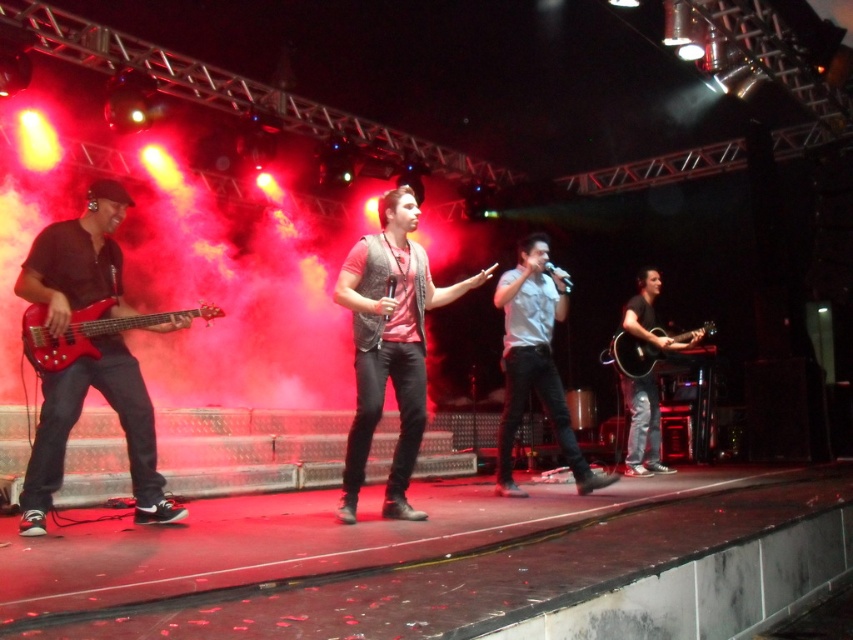
Measure the distance between matte black bass guitar at left and camera.

3.56 meters

Does matte black bass guitar at left have a greater width compared to gray matte shirt at center?

No.

Find the location of a particular element. The height and width of the screenshot is (640, 853). matte black bass guitar at left is located at coordinates (74, 420).

Who is lower down, denim vest at center or acoustic guitar at right?

acoustic guitar at right

Is denim vest at center closer to the viewer compared to acoustic guitar at right?

That is True.

Is point (404, 388) positioned after point (627, 320)?

That is False.

Find the location of `denim vest at center`. denim vest at center is located at coordinates (389, 344).

Between matte black bass guitar at left and shiny red electric guitar at left, which one is positioned higher?

shiny red electric guitar at left

Is point (73, 253) positioned before point (154, 323)?

Yes.

At what (x,y) coordinates should I click in order to perform the action: click on matte black bass guitar at left. Please return your answer as a coordinate pair (x, y). The width and height of the screenshot is (853, 640). Looking at the image, I should click on (74, 420).